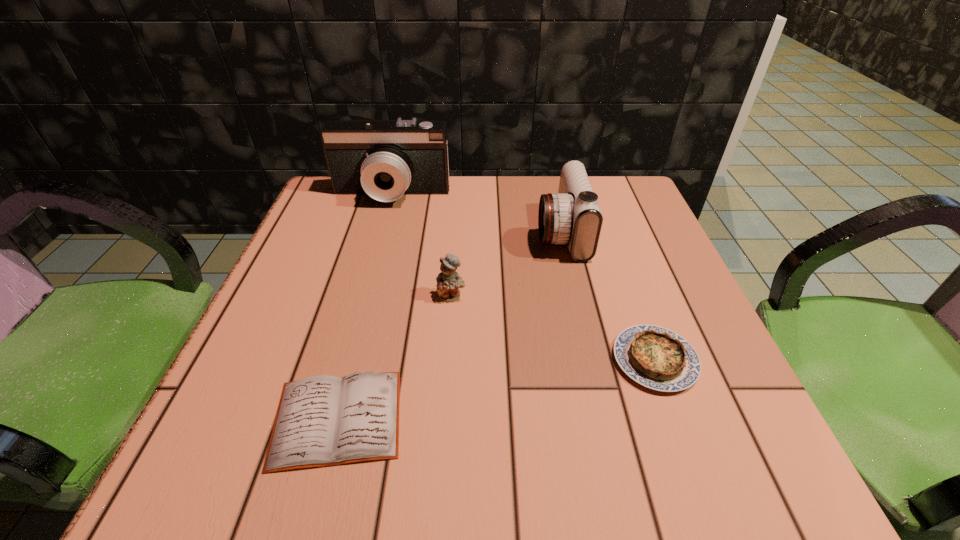
Locate which object is the fourth closest to the shortest object. Please provide its 2D coordinates. Your answer should be formatted as a tuple, i.e. [(x, y)], where the tuple contains the x and y coordinates of a point satisfying the conditions above.

[(385, 159)]

You are a GUI agent. You are given a task and a screenshot of the screen. Output one action in this format:
    pyautogui.click(x=<x>, y=<y>)
    Task: Click on the object identified as the second closest to the left camcorder
    
    Given the screenshot: What is the action you would take?
    point(448,281)

Identify the location of free location that satisfies the following two spatial constraints: 1. on the lens of the quiche; 2. on the left side of the taller camcorder. The height and width of the screenshot is (540, 960). (346, 360).

The image size is (960, 540). In order to click on free spot that satisfies the following two spatial constraints: 1. on the surface of the fourth shortest object; 2. on the front side of the diary in this screenshot , I will do `click(604, 418)`.

The width and height of the screenshot is (960, 540). In order to click on vacant space that satisfies the following two spatial constraints: 1. on the surface of the fourth tallest object; 2. on the right side of the second tallest object in this screenshot , I will do click(x=590, y=360).

The image size is (960, 540). I want to click on vacant point that satisfies the following two spatial constraints: 1. on the back side of the shortest object; 2. on the right side of the quiche, so click(353, 360).

Where is `vacant space that satisfies the following two spatial constraints: 1. on the surface of the right camcorder; 2. on the right side of the quiche`? The width and height of the screenshot is (960, 540). vacant space that satisfies the following two spatial constraints: 1. on the surface of the right camcorder; 2. on the right side of the quiche is located at coordinates (590, 360).

Identify the location of free space that satisfies the following two spatial constraints: 1. on the lens of the diary; 2. on the left side of the taller camcorder. Image resolution: width=960 pixels, height=540 pixels. (329, 418).

Find the location of a particular element. free space that satisfies the following two spatial constraints: 1. on the lens of the tallest object; 2. on the left side of the quiche is located at coordinates (346, 360).